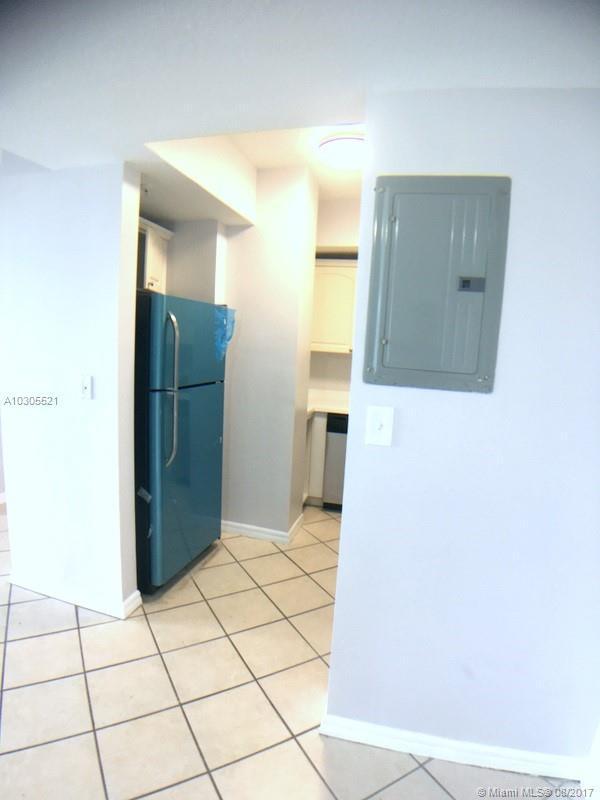
At what (x,y) coordinates should I click in order to perform the action: click on refrigerator. Please return your answer as a coordinate pair (x, y). This screenshot has width=600, height=800. Looking at the image, I should click on (190, 410).